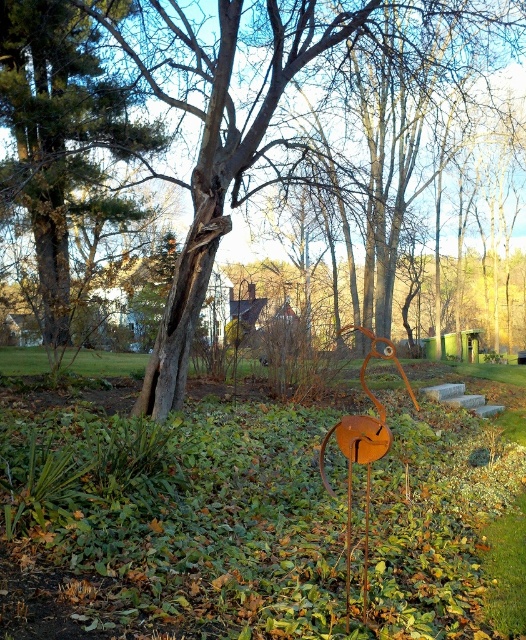
Is green matte grass at center to the right of brown textured tree at upper left from the viewer's perspective?

Indeed, green matte grass at center is positioned on the right side of brown textured tree at upper left.

Based on the photo, how far apart are green matte grass at center and brown textured tree at upper left?

They are 10.57 meters apart.

This screenshot has width=526, height=640. In order to click on green matte grass at center in this screenshot , I will do `click(186, 515)`.

Where is `green matte grass at center`? This screenshot has height=640, width=526. green matte grass at center is located at coordinates (186, 515).

Can you confirm if brown wood tree at center is taller than brown textured tree at upper left?

Yes.

Can you confirm if brown wood tree at center is bigger than brown textured tree at upper left?

Yes, brown wood tree at center is bigger than brown textured tree at upper left.

Locate an element on the screen. The width and height of the screenshot is (526, 640). brown wood tree at center is located at coordinates (239, 113).

At what (x,y) coordinates should I click in order to perform the action: click on brown wood tree at center. Please return your answer as a coordinate pair (x, y). Image resolution: width=526 pixels, height=640 pixels. Looking at the image, I should click on (239, 113).

Who is positioned more to the left, green matte grass at center or brown wood tree at center?

Positioned to the left is green matte grass at center.

Does green matte grass at center have a lesser width compared to brown wood tree at center?

Indeed, green matte grass at center has a lesser width compared to brown wood tree at center.

The height and width of the screenshot is (640, 526). I want to click on green matte grass at center, so click(x=186, y=515).

The image size is (526, 640). In order to click on green matte grass at center in this screenshot , I will do `click(186, 515)`.